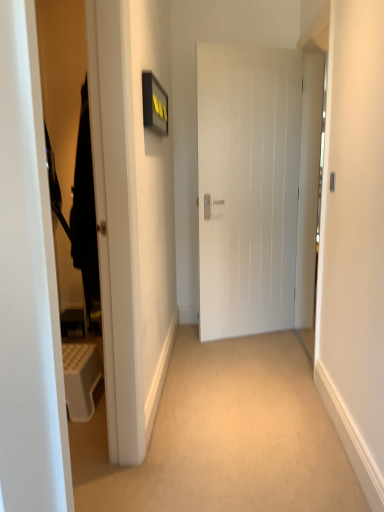
Question: Can you confirm if satin silver door handle at center is positioned to the left of white matte door at center?

Choices:
 (A) no
 (B) yes

Answer: (A)

Question: Can you confirm if satin silver door handle at center is wider than white matte door at center?

Choices:
 (A) no
 (B) yes

Answer: (A)

Question: Is satin silver door handle at center further to the viewer compared to white matte door at center?

Choices:
 (A) no
 (B) yes

Answer: (A)

Question: From a real-world perspective, is satin silver door handle at center on top of white matte door at center?

Choices:
 (A) yes
 (B) no

Answer: (A)

Question: Can we say satin silver door handle at center lies outside white matte door at center?

Choices:
 (A) no
 (B) yes

Answer: (B)

Question: Is satin silver door handle at center bigger or smaller than black fabric robe at left?

Choices:
 (A) small
 (B) big

Answer: (A)

Question: Considering their positions, is satin silver door handle at center located in front of or behind black fabric robe at left?

Choices:
 (A) front
 (B) behind

Answer: (B)

Question: In the image, is satin silver door handle at center on the left side or the right side of black fabric robe at left?

Choices:
 (A) right
 (B) left

Answer: (A)

Question: From a real-world perspective, relative to black fabric robe at left, is satin silver door handle at center vertically above or below?

Choices:
 (A) below
 (B) above

Answer: (B)

Question: Visually, is white matte door at center positioned to the left or to the right of black fabric robe at left?

Choices:
 (A) right
 (B) left

Answer: (A)

Question: From the image's perspective, relative to black fabric robe at left, is white matte door at center above or below?

Choices:
 (A) below
 (B) above

Answer: (B)

Question: Is point (273, 276) closer or farther from the camera than point (87, 105)?

Choices:
 (A) farther
 (B) closer

Answer: (A)

Question: Is white matte door at center in front of or behind black fabric robe at left in the image?

Choices:
 (A) front
 (B) behind

Answer: (B)

Question: Is white matte door at center spatially inside satin silver door handle at center, or outside of it?

Choices:
 (A) outside
 (B) inside

Answer: (A)

Question: Would you say white matte door at center is to the left or to the right of satin silver door handle at center in the picture?

Choices:
 (A) right
 (B) left

Answer: (B)